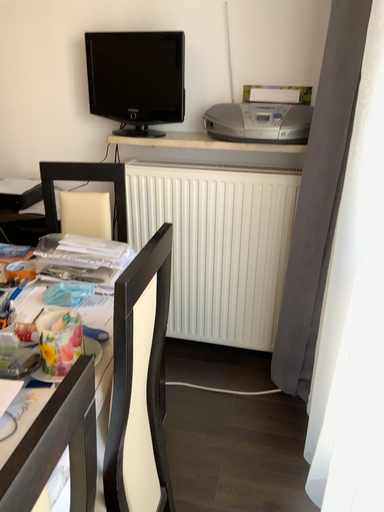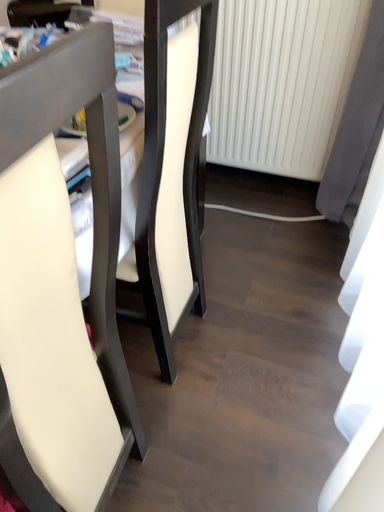
Question: How did the camera likely rotate when shooting the video?

Choices:
 (A) rotated upward
 (B) rotated downward

Answer: (B)